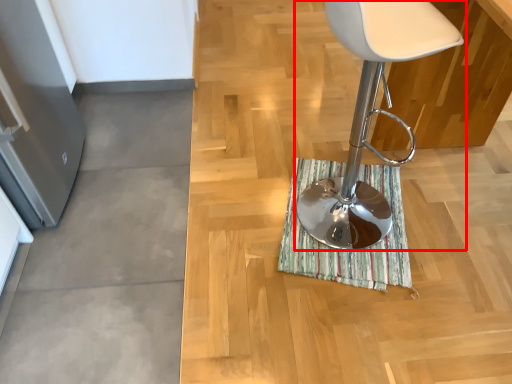
Question: From the image, what is the correct spatial relationship of chair (annotated by the red box) in relation to bath mat?

Choices:
 (A) right
 (B) left

Answer: (B)